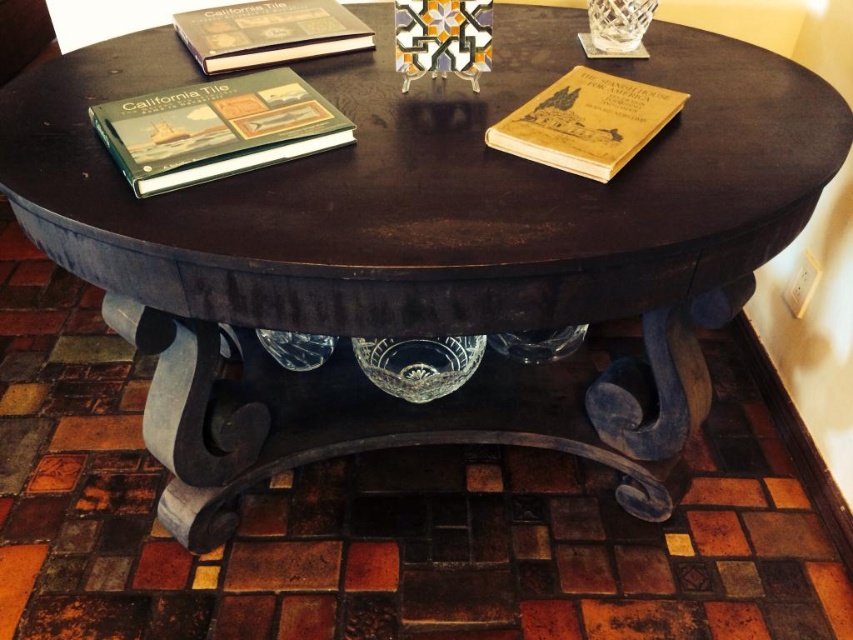
Question: Does green matte book at upper left appear under hardcover book at upper left?

Choices:
 (A) yes
 (B) no

Answer: (A)

Question: Among these points, which one is nearest to the camera?

Choices:
 (A) (206, 56)
 (B) (251, 131)
 (C) (608, 109)

Answer: (B)

Question: Which of the following is the closest to the observer?

Choices:
 (A) hardcover book at upper left
 (B) yellow paper book at upper right

Answer: (B)

Question: Does yellow paper book at upper right have a larger size compared to hardcover book at upper left?

Choices:
 (A) yes
 (B) no

Answer: (B)

Question: Is yellow paper book at upper right positioned in front of hardcover book at upper left?

Choices:
 (A) no
 (B) yes

Answer: (B)

Question: Estimate the real-world distances between objects in this image. Which object is closer to the green matte book at upper left?

Choices:
 (A) hardcover book at upper left
 (B) yellow paper book at upper right

Answer: (A)